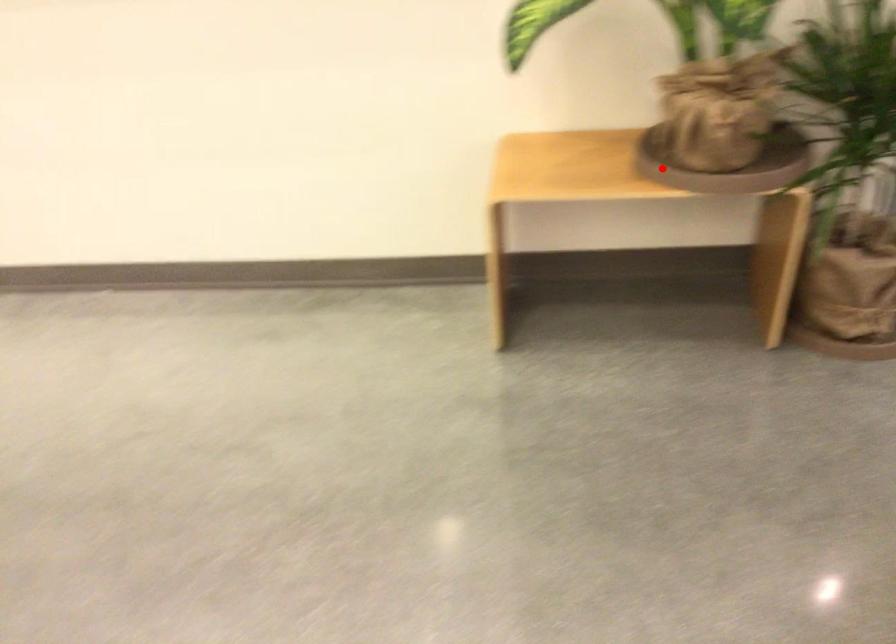
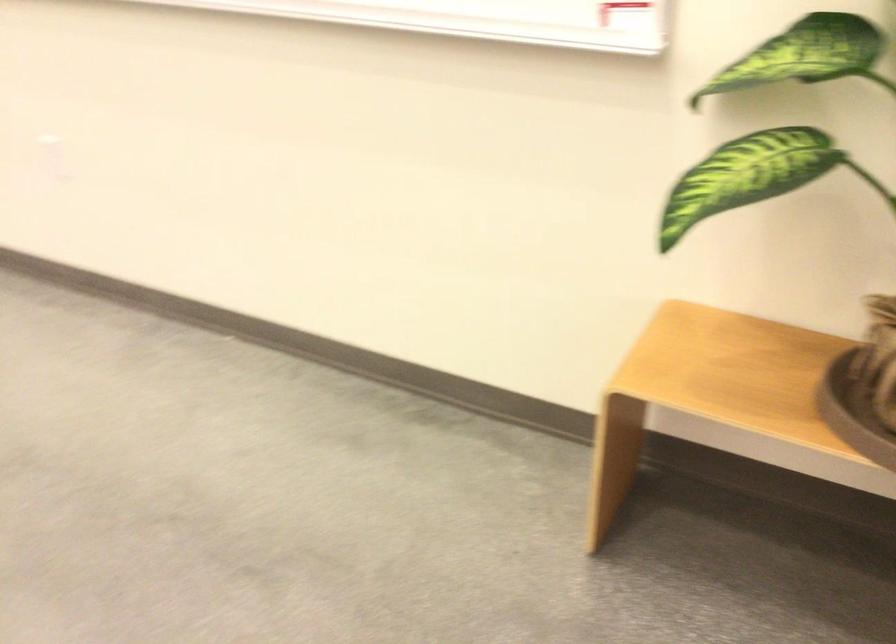
Question: I am providing you with two images of the same scene from different viewpoints. Given a red point in image1, look at the same physical point in image2. Is it:

Choices:
 (A) Closer to the viewpoint
 (B) Farther from the viewpoint

Answer: (A)